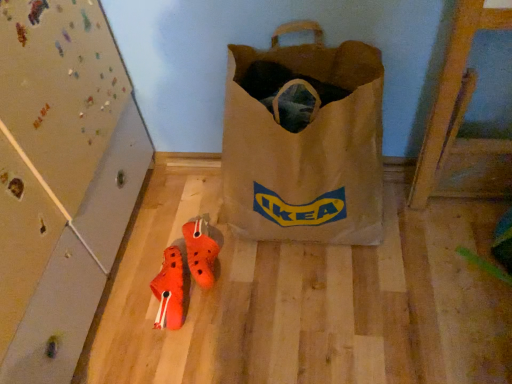
Find the location of `vacant point to the right of orange rubber clogs at center, the 2th footwear from the left`. vacant point to the right of orange rubber clogs at center, the 2th footwear from the left is located at coordinates (261, 268).